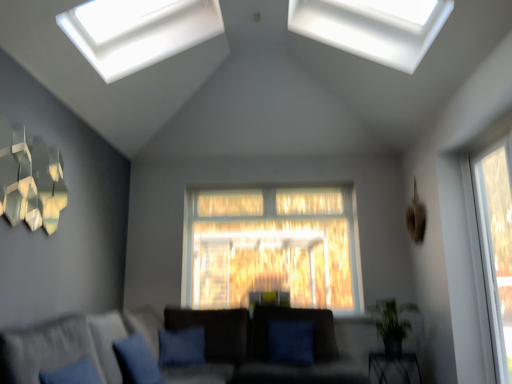
Question: From a real-world perspective, relative to green leafy plant at lower right, is transparent glass window at upper center, the 3th window viewed from the right, vertically above or below?

Choices:
 (A) above
 (B) below

Answer: (A)

Question: Looking at their shapes, would you say transparent glass window at upper center, arranged as the 1th window when viewed from the left, is wider or thinner than green leafy plant at lower right?

Choices:
 (A) thin
 (B) wide

Answer: (B)

Question: Considering the real-world distances, which object is closest to the metallic geometric art at upper left?

Choices:
 (A) blue fabric pillow at lower center
 (B) dark gray fabric couch at lower left
 (C) blue fabric pillow at center
 (D) transparent glass window at upper center, arranged as the 1th window when viewed from the left
 (E) transparent glass window at upper center, marked as the second window in a right-to-left arrangement

Answer: (D)

Question: Considering the real-world distances, which object is closest to the transparent glass window at upper center, which appears as the 2th window when viewed from the top?

Choices:
 (A) transparent glass window at upper center, marked as the second window in a right-to-left arrangement
 (B) metallic black table at lower right
 (C) metallic geometric art at upper left
 (D) green leafy plant at lower right
 (E) dark gray fabric couch at lower left

Answer: (A)